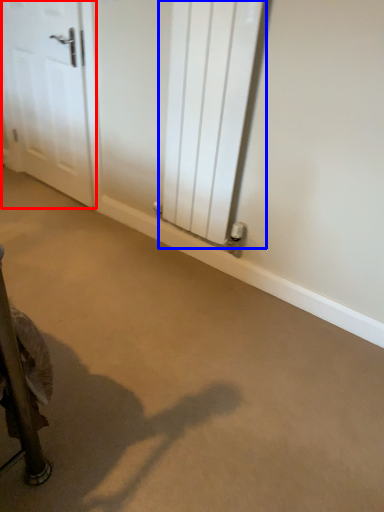
Question: Among these objects, which one is nearest to the camera, door (highlighted by a red box) or radiator (highlighted by a blue box)?

Choices:
 (A) door
 (B) radiator

Answer: (B)